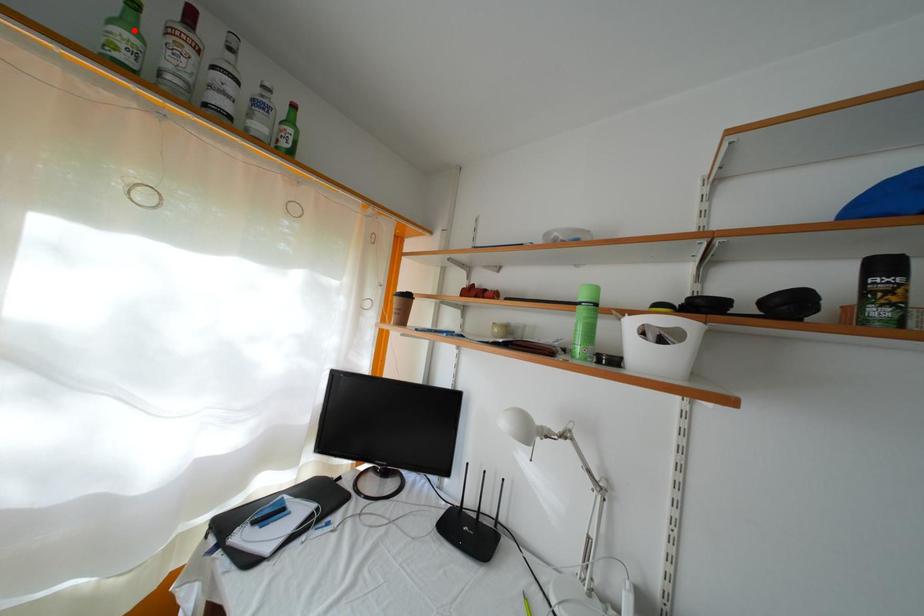
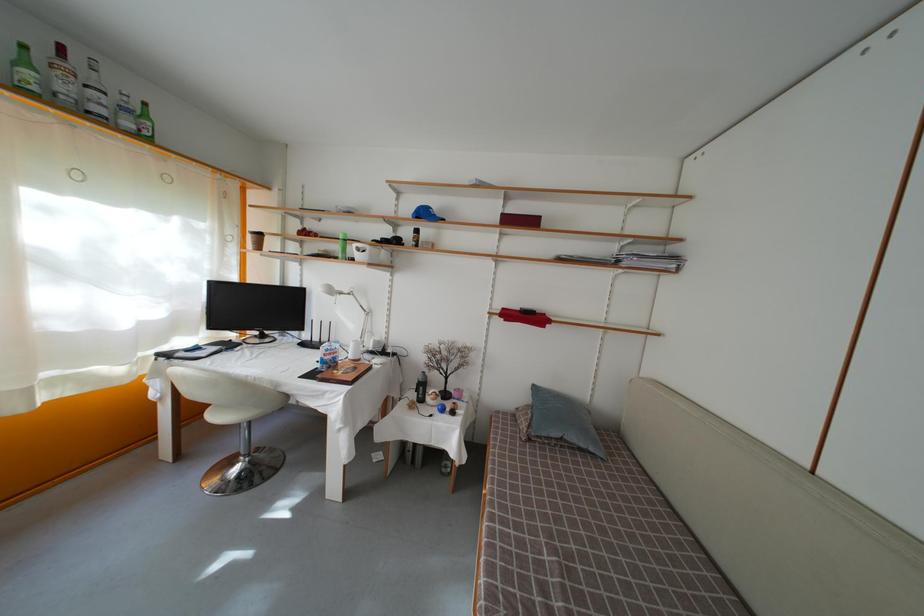
In the second image, find the point that corresponds to the highlighted location in the first image.

(31, 69)